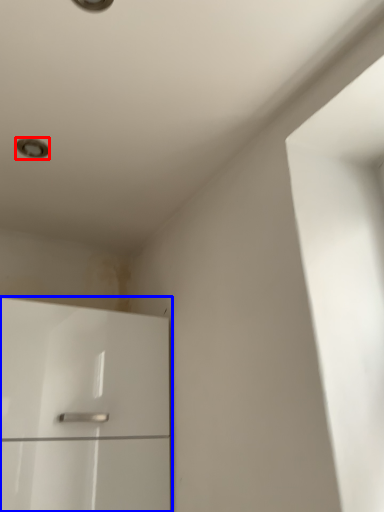
Question: Among these objects, which one is nearest to the camera, dot (highlighted by a red box) or cabinetry (highlighted by a blue box)?

Choices:
 (A) dot
 (B) cabinetry

Answer: (B)